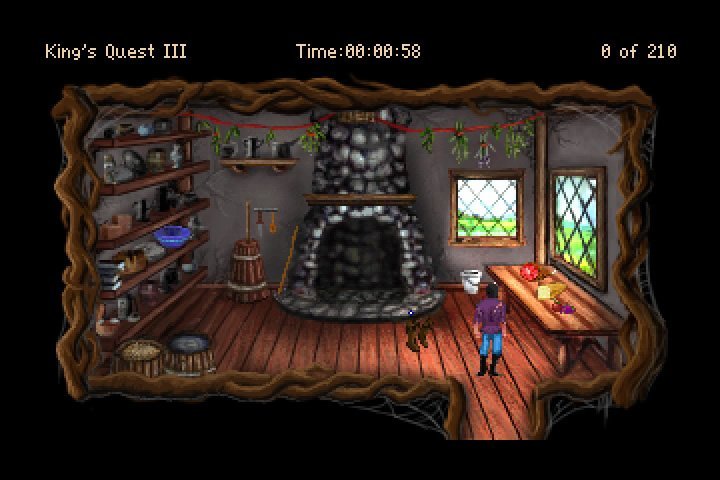
Locate an element on the screen. This screenshot has width=720, height=480. fireplace is located at coordinates (378, 265).